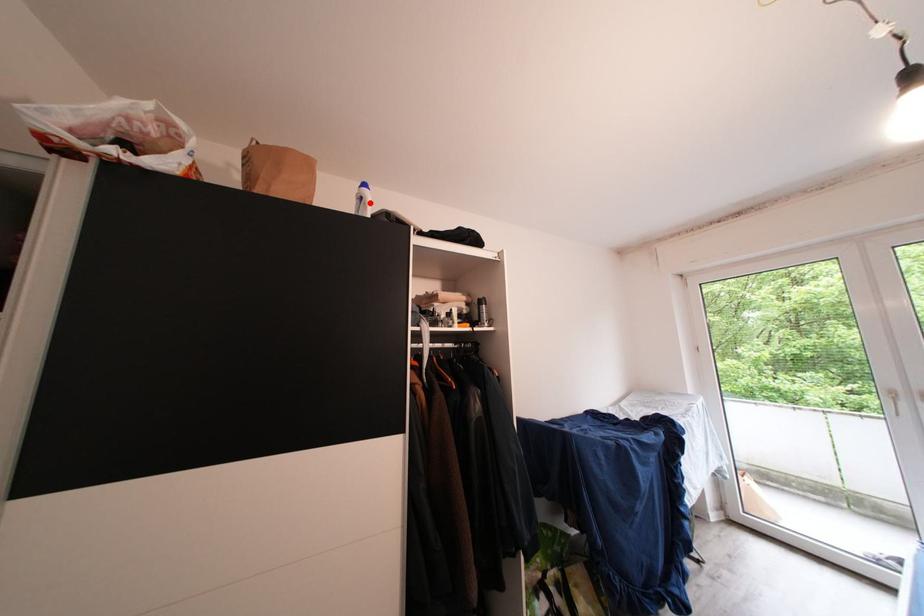
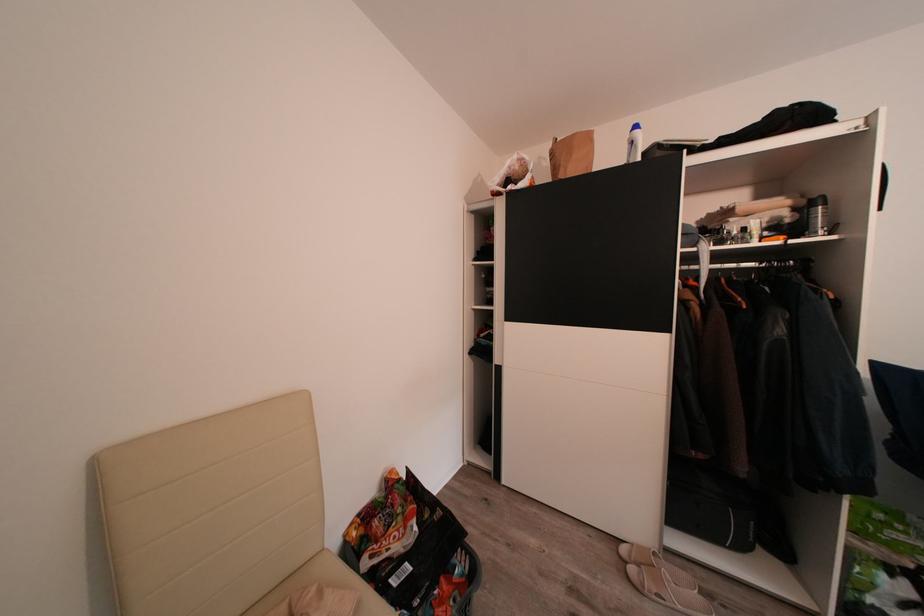
In the second image, find the point that corresponds to the highlighted location in the first image.

(640, 148)